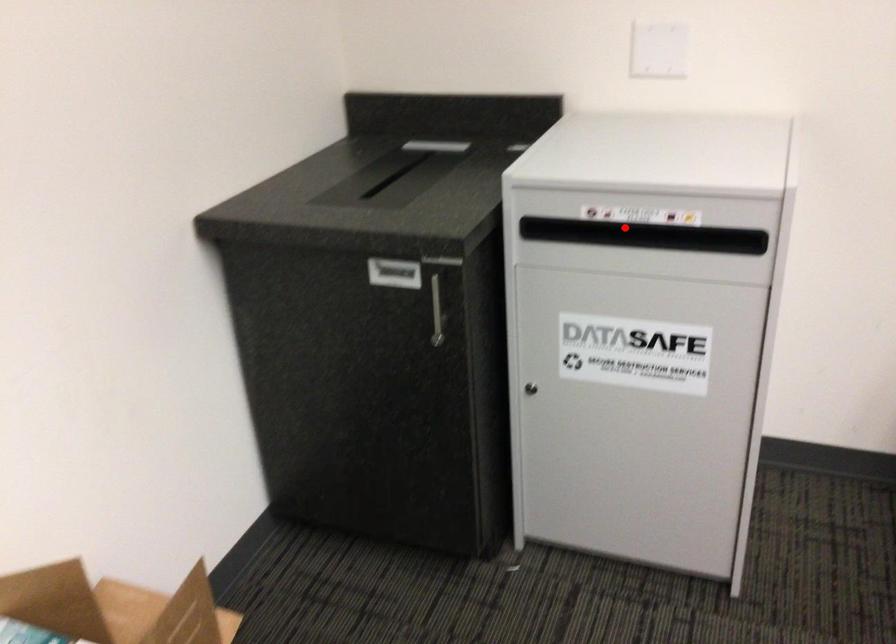
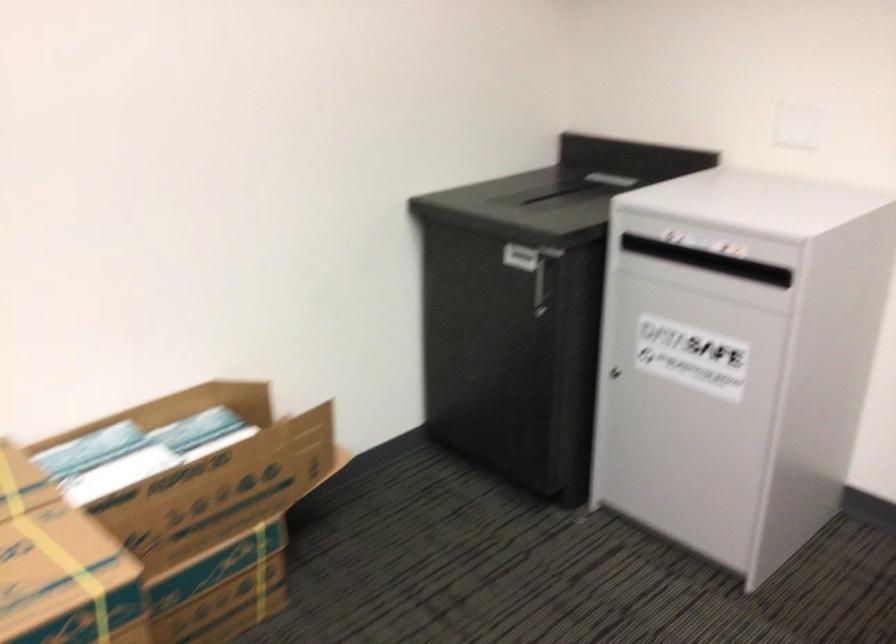
Question: I am providing you with two images of the same scene from different viewpoints. Given a red point in image1, look at the same physical point in image2. Is it:

Choices:
 (A) Closer to the viewpoint
 (B) Farther from the viewpoint

Answer: (B)